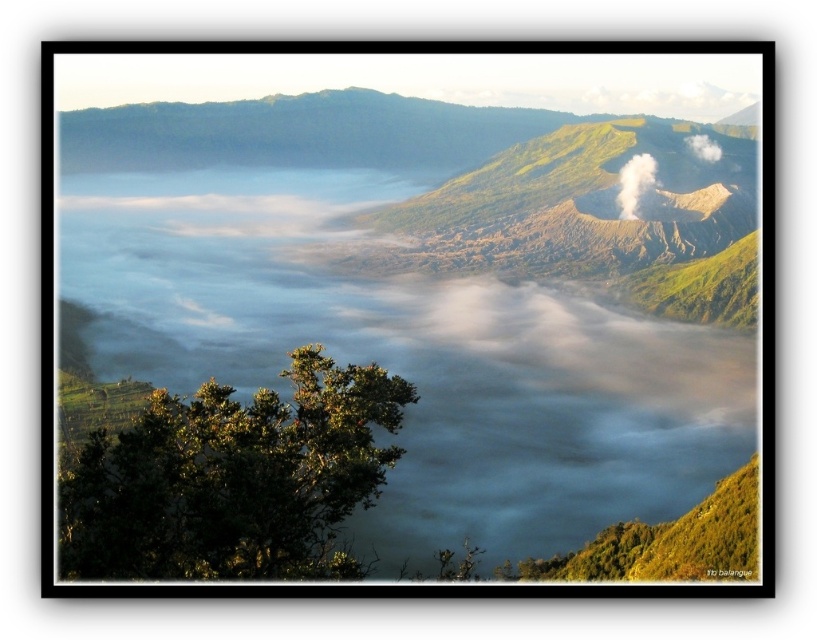
Which of these two, white misty cloud at center or green leafy tree at lower left, stands shorter?

With less height is green leafy tree at lower left.

Who is more forward, (154,312) or (307,388)?

Point (307,388) is in front.

At what (x,y) coordinates should I click in order to perform the action: click on white misty cloud at center. Please return your answer as a coordinate pair (x, y). Looking at the image, I should click on click(435, 291).

Is white misty cloud at center taller than white smoke at upper center?

Yes.

Which of these two, white misty cloud at center or white smoke at upper center, stands taller?

With more height is white misty cloud at center.

This screenshot has height=640, width=817. Identify the location of white misty cloud at center. (435, 291).

Which is more to the left, green leafy tree at lower left or white smoke at upper center?

green leafy tree at lower left

Does green leafy tree at lower left have a greater width compared to white smoke at upper center?

Yes, green leafy tree at lower left is wider than white smoke at upper center.

Is point (186, 440) positioned in front of point (626, 180)?

Yes, point (186, 440) is in front of point (626, 180).

What are the coordinates of `green leafy tree at lower left` in the screenshot? It's located at (231, 477).